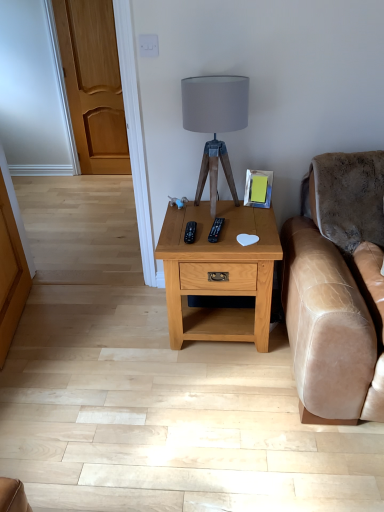
Where is `vacant space in front of light brown wood nightstand at center`? The width and height of the screenshot is (384, 512). vacant space in front of light brown wood nightstand at center is located at coordinates (219, 394).